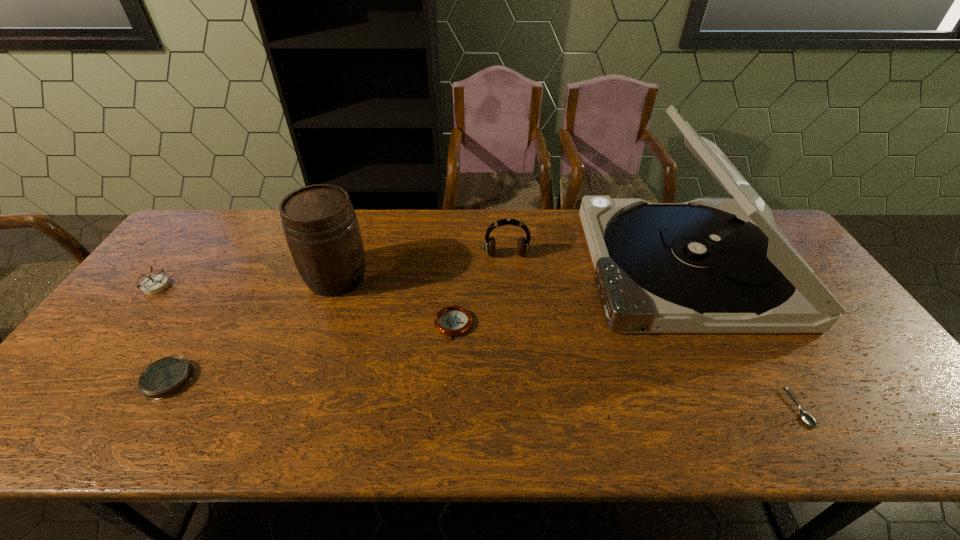
At what (x,y) coordinates should I click in order to perform the action: click on the nearest compass. Please return your answer as a coordinate pair (x, y). The width and height of the screenshot is (960, 540). Looking at the image, I should click on (167, 376).

What are the coordinates of `the shortest object` in the screenshot? It's located at (807, 418).

Where is `free point located on the control panel of the tallest object`? This screenshot has height=540, width=960. free point located on the control panel of the tallest object is located at coordinates (486, 267).

Locate an element on the screen. The width and height of the screenshot is (960, 540). free spot located 0.070m on the control panel of the tallest object is located at coordinates (564, 267).

You are a GUI agent. You are given a task and a screenshot of the screen. Output one action in this format:
    pyautogui.click(x=<x>, y=<y>)
    Task: Click on the vacant space located 0.190m on the control panel of the tallest object
    This screenshot has height=540, width=960.
    Given the screenshot: What is the action you would take?
    pyautogui.click(x=525, y=267)

The height and width of the screenshot is (540, 960). I want to click on vacant space located on the side of the third object from left to right near the bung hole, so click(322, 320).

Where is `free location located on the ear cup of the headset`? This screenshot has width=960, height=540. free location located on the ear cup of the headset is located at coordinates (511, 323).

In order to click on vacant space situated on the front of the tallest compass in this screenshot , I will do `click(65, 407)`.

At what (x,y) coordinates should I click in order to perform the action: click on free space located on the front of the rightmost compass. Please return your answer as a coordinate pair (x, y). The height and width of the screenshot is (540, 960). Looking at the image, I should click on (450, 376).

In order to click on vacant space located 0.080m on the front of the second compass from right to left in this screenshot , I will do `click(135, 433)`.